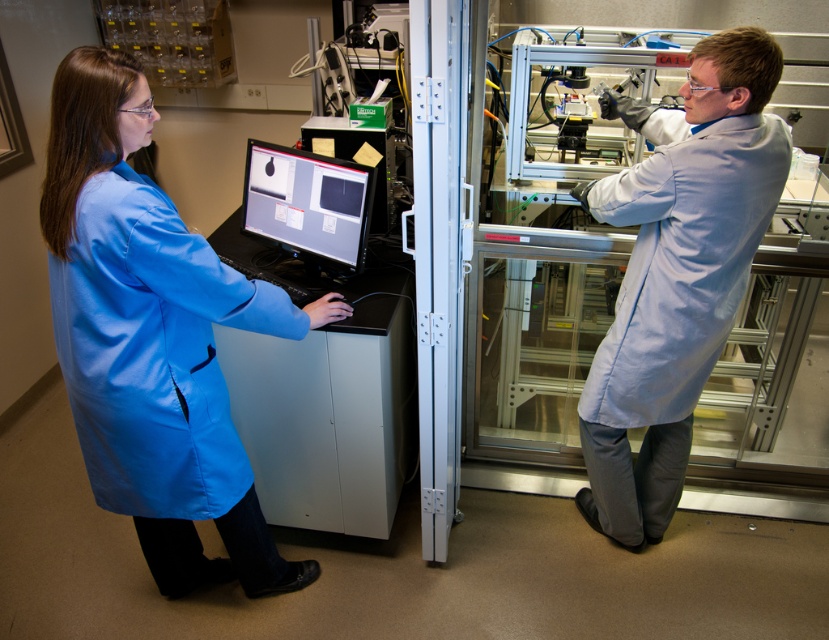
Does point (711, 218) come in front of point (335, 214)?

Yes.

Which is above, light blue lab coat at right or matte black monitor at center?

matte black monitor at center

Who is more distant from viewer, (762,33) or (355,179)?

The point (355,179) is behind.

At what (x,y) coordinates should I click in order to perform the action: click on light blue lab coat at right. Please return your answer as a coordinate pair (x, y). This screenshot has width=829, height=640. Looking at the image, I should click on (676, 273).

Is blue matte lab coat at center smaller than matte black monitor at center?

Incorrect, blue matte lab coat at center is not smaller in size than matte black monitor at center.

Is blue matte lab coat at center to the left of matte black monitor at center from the viewer's perspective?

Indeed, blue matte lab coat at center is positioned on the left side of matte black monitor at center.

The image size is (829, 640). In order to click on blue matte lab coat at center in this screenshot , I will do `click(153, 337)`.

Is blue matte lab coat at center taller than light blue lab coat at right?

No, blue matte lab coat at center is not taller than light blue lab coat at right.

Is blue matte lab coat at center bigger than light blue lab coat at right?

Indeed, blue matte lab coat at center has a larger size compared to light blue lab coat at right.

The width and height of the screenshot is (829, 640). What do you see at coordinates (153, 337) in the screenshot? I see `blue matte lab coat at center` at bounding box center [153, 337].

Locate an element on the screen. blue matte lab coat at center is located at coordinates (153, 337).